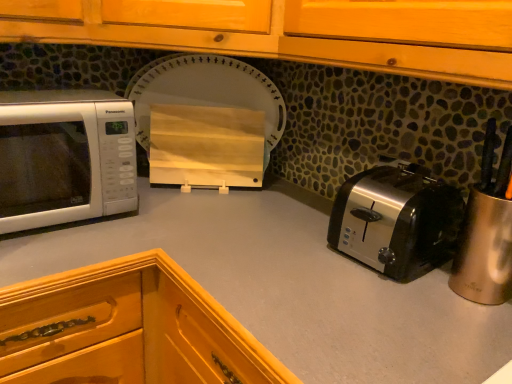
Question: Does wooden cutting board at center have a lesser height compared to smooth gray countertop at center?

Choices:
 (A) yes
 (B) no

Answer: (A)

Question: From the image's perspective, is wooden cutting board at center on top of smooth gray countertop at center?

Choices:
 (A) yes
 (B) no

Answer: (A)

Question: Can smooth gray countertop at center be found inside wooden cutting board at center?

Choices:
 (A) yes
 (B) no

Answer: (B)

Question: Considering the relative sizes of wooden cutting board at center and smooth gray countertop at center in the image provided, is wooden cutting board at center smaller than smooth gray countertop at center?

Choices:
 (A) yes
 (B) no

Answer: (A)

Question: Is wooden cutting board at center oriented towards smooth gray countertop at center?

Choices:
 (A) yes
 (B) no

Answer: (B)

Question: Can you confirm if wooden cutting board at center is taller than smooth gray countertop at center?

Choices:
 (A) no
 (B) yes

Answer: (A)

Question: Is smooth gray countertop at center positioned in front of satin silver toaster at lower right?

Choices:
 (A) no
 (B) yes

Answer: (B)

Question: From a real-world perspective, is smooth gray countertop at center located higher than satin silver toaster at lower right?

Choices:
 (A) yes
 (B) no

Answer: (B)

Question: Does smooth gray countertop at center have a greater height compared to satin silver toaster at lower right?

Choices:
 (A) no
 (B) yes

Answer: (B)

Question: Can you confirm if smooth gray countertop at center is positioned to the right of satin silver toaster at lower right?

Choices:
 (A) no
 (B) yes

Answer: (A)

Question: Is smooth gray countertop at center positioned with its back to satin silver toaster at lower right?

Choices:
 (A) no
 (B) yes

Answer: (A)

Question: Does smooth gray countertop at center have a larger size compared to satin silver toaster at lower right?

Choices:
 (A) no
 (B) yes

Answer: (B)

Question: From a real-world perspective, is smooth gray countertop at center under white glossy microwave at left?

Choices:
 (A) yes
 (B) no

Answer: (A)